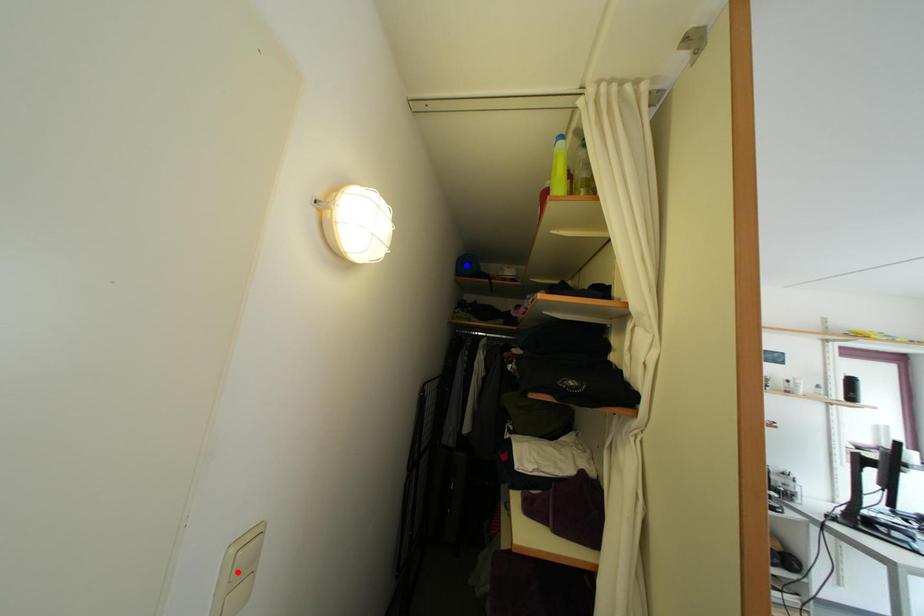
Question: In the image, two points are highlighted. Which point is nearer to the camera? Reply with the corresponding letter.

Choices:
 (A) blue point
 (B) red point

Answer: (B)